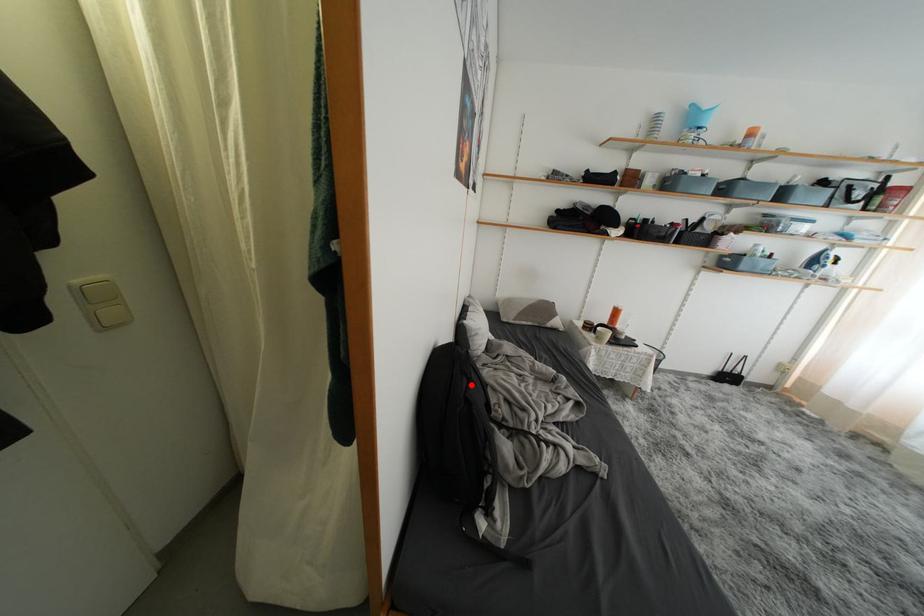
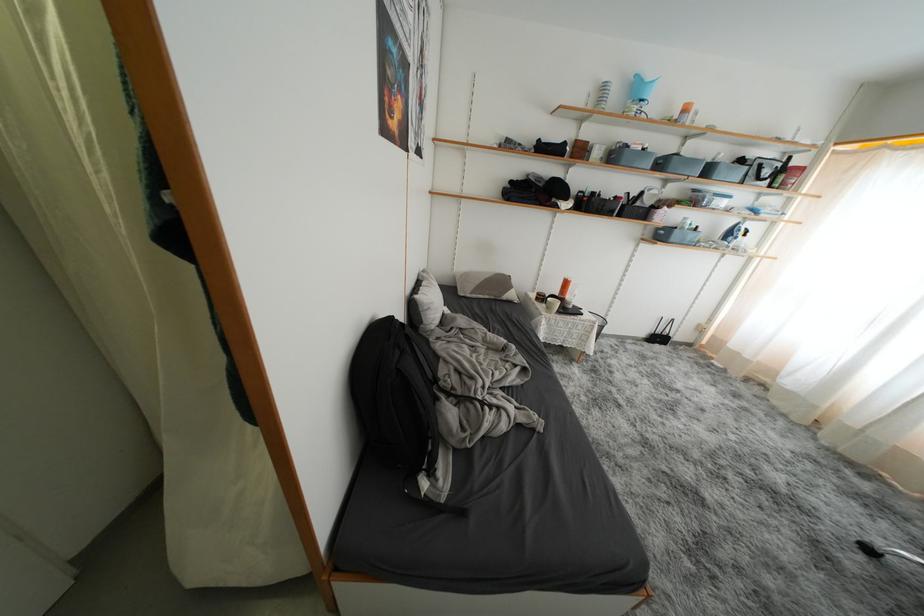
Find the pixel in the second image that matches the highlighted location in the first image.

(404, 357)